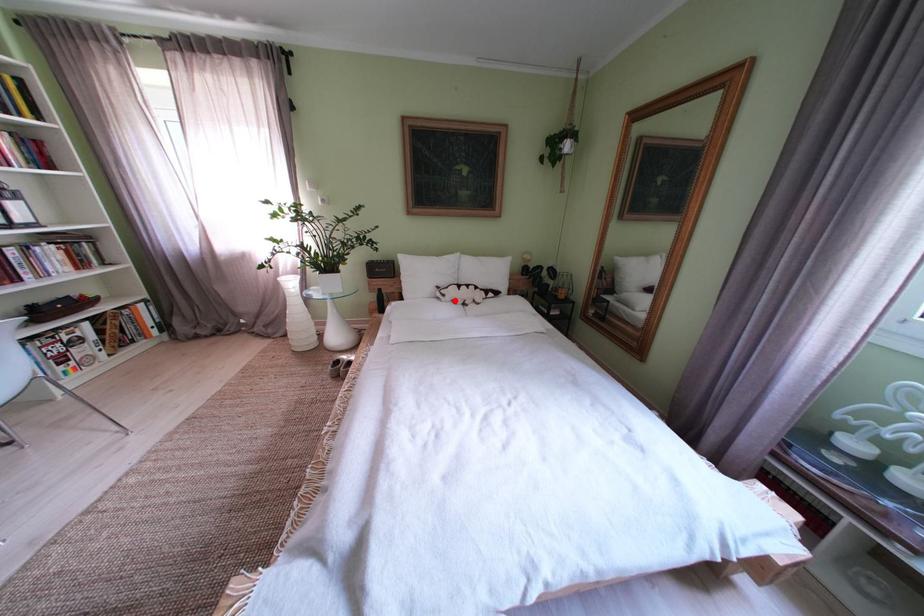
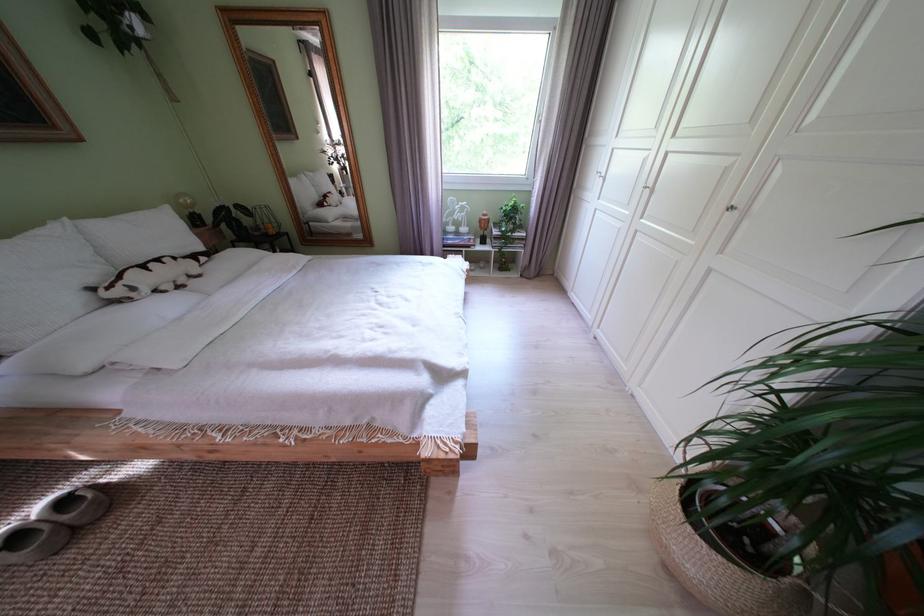
Question: I am providing you with two images of the same scene from different viewpoints. Given a red point in image1, look at the same physical point in image2. Is it:

Choices:
 (A) Closer to the viewpoint
 (B) Farther from the viewpoint

Answer: (B)